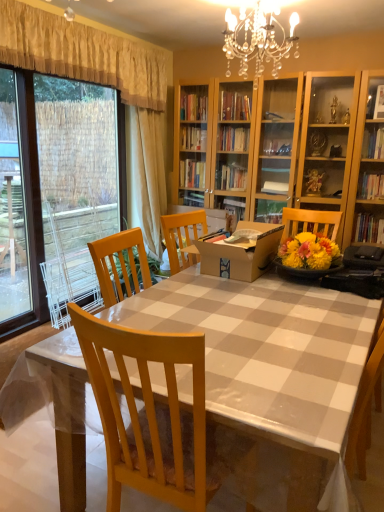
The width and height of the screenshot is (384, 512). Describe the element at coordinates (81, 54) in the screenshot. I see `yellow textured curtain at upper left, marked as the second curtain in a back-to-front arrangement` at that location.

Describe the element at coordinates (270, 358) in the screenshot. This screenshot has height=512, width=384. I see `white glossy table at center` at that location.

In order to click on yellow textured curtain at upper left, marked as the second curtain in a back-to-front arrangement in this screenshot , I will do 81,54.

Is yellow textured curtain at upper left, marked as the first curtain in a front-to-back arrangement, not close to transparent glass door at left?

No, yellow textured curtain at upper left, marked as the first curtain in a front-to-back arrangement, is not far away from transparent glass door at left.

Does yellow textured curtain at upper left, marked as the first curtain in a front-to-back arrangement, have a lesser height compared to transparent glass door at left?

Indeed, yellow textured curtain at upper left, marked as the first curtain in a front-to-back arrangement, has a lesser height compared to transparent glass door at left.

In terms of width, does yellow textured curtain at upper left, marked as the first curtain in a front-to-back arrangement, look wider or thinner when compared to transparent glass door at left?

Clearly, yellow textured curtain at upper left, marked as the first curtain in a front-to-back arrangement, has more width compared to transparent glass door at left.

Looking at the image, does yellow textured curtain at upper left, marked as the second curtain in a back-to-front arrangement, seem bigger or smaller compared to transparent glass door at left?

Considering their sizes, yellow textured curtain at upper left, marked as the second curtain in a back-to-front arrangement, takes up less space than transparent glass door at left.

Are white glossy table at center and beige fabric curtain at upper left, which appears as the 1th curtain when viewed from the back, making contact?

No, white glossy table at center is not touching beige fabric curtain at upper left, which appears as the 1th curtain when viewed from the back.

Based on the photo, is white glossy table at center oriented towards beige fabric curtain at upper left, which ranks as the 2th curtain in front-to-back order?

No, white glossy table at center is not turned towards beige fabric curtain at upper left, which ranks as the 2th curtain in front-to-back order.

In the image, is white glossy table at center on the left side or the right side of beige fabric curtain at upper left, which ranks as the 2th curtain in front-to-back order?

Clearly, white glossy table at center is on the right of beige fabric curtain at upper left, which ranks as the 2th curtain in front-to-back order, in the image.

Who is taller, white glossy table at center or beige fabric curtain at upper left, which appears as the 1th curtain when viewed from the back?

Standing taller between the two is beige fabric curtain at upper left, which appears as the 1th curtain when viewed from the back.

Who is shorter, transparent glass door at left or beige fabric curtain at upper left, which appears as the 1th curtain when viewed from the back?

Standing shorter between the two is beige fabric curtain at upper left, which appears as the 1th curtain when viewed from the back.

Does point (67, 123) come farther from viewer compared to point (161, 246)?

Yes.

Is transparent glass door at left not close to beige fabric curtain at upper left, which appears as the 1th curtain when viewed from the back?

They are positioned close to each other.

How different are the orientations of transparent glass door at left and beige fabric curtain at upper left, which ranks as the 2th curtain in front-to-back order, in degrees?

The facing directions of transparent glass door at left and beige fabric curtain at upper left, which ranks as the 2th curtain in front-to-back order, are 2.76 degrees apart.

From a real-world perspective, which object stands above the other?

transparent glass door at left, from a real-world perspective.

From the picture: Is transparent glass door at left in front of white glossy table at center?

No.

Considering the positions of point (1, 327) and point (121, 319), is point (1, 327) closer or farther from the camera than point (121, 319)?

Point (1, 327) appears to be farther away from the viewer than point (121, 319).

Is transparent glass door at left not near white glossy table at center?

Yes.

Is beige fabric curtain at upper left, which appears as the 1th curtain when viewed from the back, shorter than transparent glass door at left?

Yes, beige fabric curtain at upper left, which appears as the 1th curtain when viewed from the back, is shorter than transparent glass door at left.

From a real-world perspective, is beige fabric curtain at upper left, which ranks as the 2th curtain in front-to-back order, below transparent glass door at left?

No, from a real-world perspective, beige fabric curtain at upper left, which ranks as the 2th curtain in front-to-back order, is not beneath transparent glass door at left.

Consider the image. Is beige fabric curtain at upper left, which ranks as the 2th curtain in front-to-back order, facing away from transparent glass door at left?

Yes, beige fabric curtain at upper left, which ranks as the 2th curtain in front-to-back order,'s orientation is away from transparent glass door at left.

Considering the positions of objects beige fabric curtain at upper left, which appears as the 1th curtain when viewed from the back, and transparent glass door at left in the image provided, who is behind, beige fabric curtain at upper left, which appears as the 1th curtain when viewed from the back, or transparent glass door at left?

beige fabric curtain at upper left, which appears as the 1th curtain when viewed from the back.

Considering the relative positions of white glossy table at center and transparent glass door at left in the image provided, is white glossy table at center in front of transparent glass door at left?

Yes, it is.

Is white glossy table at center turned away from transparent glass door at left?

No, white glossy table at center is not facing the opposite direction of transparent glass door at left.

How much distance is there between white glossy table at center and transparent glass door at left?

white glossy table at center is 5.31 feet away from transparent glass door at left.

Is white glossy table at center taller or shorter than transparent glass door at left?

Clearly, white glossy table at center is shorter compared to transparent glass door at left.

Between white glossy table at center and yellow textured curtain at upper left, marked as the first curtain in a front-to-back arrangement, which one has smaller size?

yellow textured curtain at upper left, marked as the first curtain in a front-to-back arrangement, is smaller.

Choose the correct answer: Is white glossy table at center inside yellow textured curtain at upper left, marked as the second curtain in a back-to-front arrangement, or outside it?

white glossy table at center is spatially situated outside yellow textured curtain at upper left, marked as the second curtain in a back-to-front arrangement.

Considering the positions of objects white glossy table at center and yellow textured curtain at upper left, marked as the first curtain in a front-to-back arrangement, in the image provided, who is more to the left, white glossy table at center or yellow textured curtain at upper left, marked as the first curtain in a front-to-back arrangement,?

yellow textured curtain at upper left, marked as the first curtain in a front-to-back arrangement, is more to the left.

Are white glossy table at center and yellow textured curtain at upper left, marked as the first curtain in a front-to-back arrangement, making contact?

No, white glossy table at center is not touching yellow textured curtain at upper left, marked as the first curtain in a front-to-back arrangement.

Locate an element on the screen. glass door behind the yellow textured curtain at upper left, marked as the first curtain in a front-to-back arrangement is located at coordinates coord(67,190).

From the image's perspective, starting from the white glossy table at center, which curtain is the 1st one above? Please provide its 2D coordinates.

[(146, 175)]

Which object lies further to the anchor point beige fabric curtain at upper left, which appears as the 1th curtain when viewed from the back, white glossy table at center or yellow textured curtain at upper left, marked as the second curtain in a back-to-front arrangement?

Among the two, white glossy table at center is located further to beige fabric curtain at upper left, which appears as the 1th curtain when viewed from the back.

Looking at the image, which one is located closer to white glossy table at center, yellow textured curtain at upper left, marked as the first curtain in a front-to-back arrangement, or beige fabric curtain at upper left, which ranks as the 2th curtain in front-to-back order?

beige fabric curtain at upper left, which ranks as the 2th curtain in front-to-back order, is closer to white glossy table at center.

From the image, which object appears to be nearer to transparent glass door at left, yellow textured curtain at upper left, marked as the first curtain in a front-to-back arrangement, or white glossy table at center?

yellow textured curtain at upper left, marked as the first curtain in a front-to-back arrangement, is positioned closer to the anchor transparent glass door at left.

Looking at the image, which one is located further to beige fabric curtain at upper left, which ranks as the 2th curtain in front-to-back order, yellow textured curtain at upper left, marked as the second curtain in a back-to-front arrangement, or white glossy table at center?

white glossy table at center is further to beige fabric curtain at upper left, which ranks as the 2th curtain in front-to-back order.

From the image, which object appears to be farther from white glossy table at center, beige fabric curtain at upper left, which appears as the 1th curtain when viewed from the back, or yellow textured curtain at upper left, marked as the second curtain in a back-to-front arrangement?

yellow textured curtain at upper left, marked as the second curtain in a back-to-front arrangement, is further to white glossy table at center.

Looking at the image, which one is located closer to yellow textured curtain at upper left, marked as the first curtain in a front-to-back arrangement, transparent glass door at left or beige fabric curtain at upper left, which appears as the 1th curtain when viewed from the back?

Based on the image, beige fabric curtain at upper left, which appears as the 1th curtain when viewed from the back, appears to be nearer to yellow textured curtain at upper left, marked as the first curtain in a front-to-back arrangement.

Estimate the real-world distances between objects in this image. Which object is closer to yellow textured curtain at upper left, marked as the second curtain in a back-to-front arrangement, transparent glass door at left or white glossy table at center?

transparent glass door at left.

Based on their spatial positions, is transparent glass door at left or yellow textured curtain at upper left, marked as the second curtain in a back-to-front arrangement, further from beige fabric curtain at upper left, which ranks as the 2th curtain in front-to-back order?

yellow textured curtain at upper left, marked as the second curtain in a back-to-front arrangement, lies further to beige fabric curtain at upper left, which ranks as the 2th curtain in front-to-back order, than the other object.

Locate an element on the screen. The image size is (384, 512). curtain located between white glossy table at center and beige fabric curtain at upper left, which appears as the 1th curtain when viewed from the back, in the depth direction is located at coordinates (81, 54).

I want to click on glass door between white glossy table at center and beige fabric curtain at upper left, which appears as the 1th curtain when viewed from the back, from front to back, so click(x=67, y=190).

At what (x,y) coordinates should I click in order to perform the action: click on glass door located between yellow textured curtain at upper left, marked as the first curtain in a front-to-back arrangement, and beige fabric curtain at upper left, which ranks as the 2th curtain in front-to-back order, in the depth direction. Please return your answer as a coordinate pair (x, y). Looking at the image, I should click on (67, 190).

Identify the location of curtain between white glossy table at center and transparent glass door at left in the front-back direction. (81, 54).